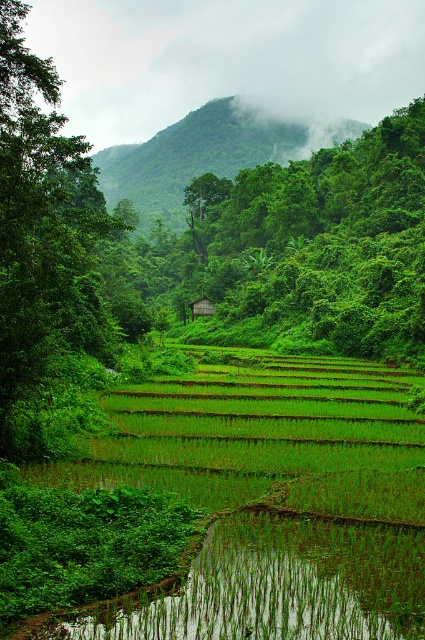
Question: Is green leafy tree at center wider than wooden hut at center?

Choices:
 (A) yes
 (B) no

Answer: (A)

Question: Which point appears farthest from the camera in this image?

Choices:
 (A) (197, 304)
 (B) (266, 538)
 (C) (337, 321)
 (D) (36, 81)

Answer: (A)

Question: Can you confirm if green leafy tree at center is wider than green leafy tree at left?

Choices:
 (A) no
 (B) yes

Answer: (B)

Question: Which is nearer to the green leafy tree at center?

Choices:
 (A) green leafy tree at left
 (B) wooden hut at center
 (C) green grassy field at center

Answer: (B)

Question: Does green leafy tree at left have a greater width compared to wooden hut at center?

Choices:
 (A) yes
 (B) no

Answer: (A)

Question: Among these objects, which one is farthest from the camera?

Choices:
 (A) wooden hut at center
 (B) green leafy tree at left

Answer: (A)